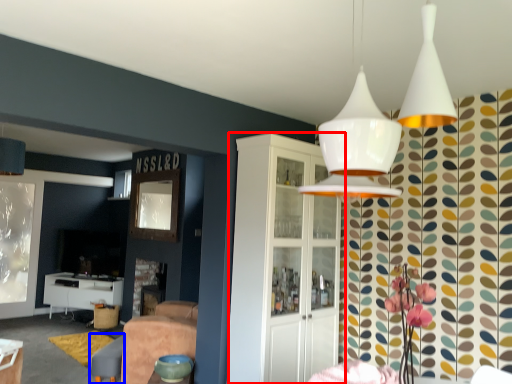
Question: Which point is closer to the camera, cabinetry (highlighted by a red box) or swivel chair (highlighted by a blue box)?

Choices:
 (A) cabinetry
 (B) swivel chair

Answer: (A)